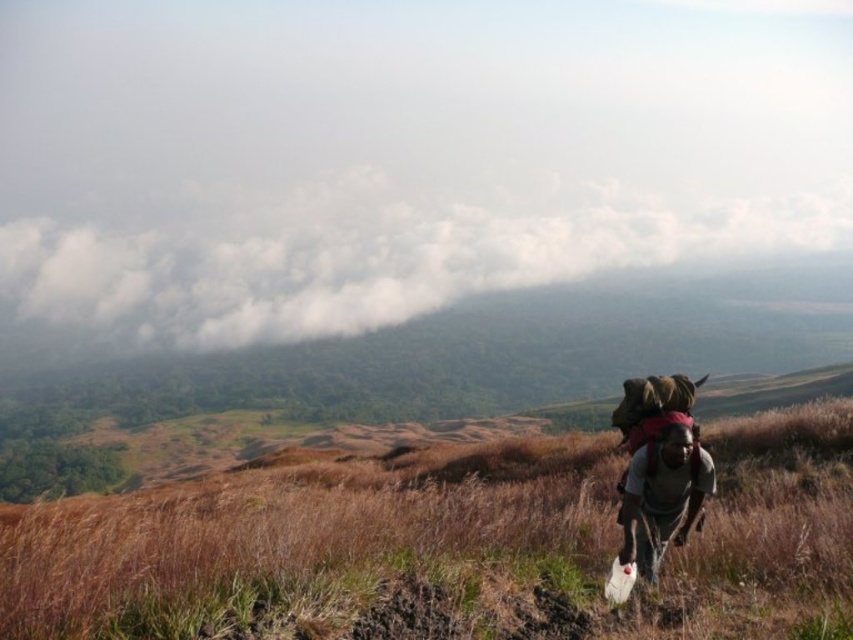
From the picture: Who is higher up, brown dry grass at lower right or gray fabric backpack at right?

gray fabric backpack at right is above.

Can you confirm if brown dry grass at lower right is wider than gray fabric backpack at right?

Yes.

At what (x,y) coordinates should I click in order to perform the action: click on brown dry grass at lower right. Please return your answer as a coordinate pair (x, y). Image resolution: width=853 pixels, height=640 pixels. Looking at the image, I should click on (320, 547).

Identify the location of white fluffy cloud at upper left. The height and width of the screenshot is (640, 853). (370, 259).

Does point (202, 291) come farther from viewer compared to point (677, 452)?

That is True.

Who is more distant from viewer, (608,250) or (639,465)?

Point (608,250)

You are a GUI agent. You are given a task and a screenshot of the screen. Output one action in this format:
    pyautogui.click(x=<x>, y=<y>)
    Task: Click on the white fluffy cloud at upper left
    The image size is (853, 640).
    Given the screenshot: What is the action you would take?
    pyautogui.click(x=370, y=259)

Who is positioned more to the left, brown dry grass at lower right or white fluffy cloud at upper left?

From the viewer's perspective, brown dry grass at lower right appears more on the left side.

Who is more forward, (x=814, y=468) or (x=595, y=260)?

Point (x=814, y=468) is in front.

Find the location of `brown dry grass at lower right`. brown dry grass at lower right is located at coordinates (320, 547).

The image size is (853, 640). Find the location of `brown dry grass at lower right`. brown dry grass at lower right is located at coordinates (320, 547).